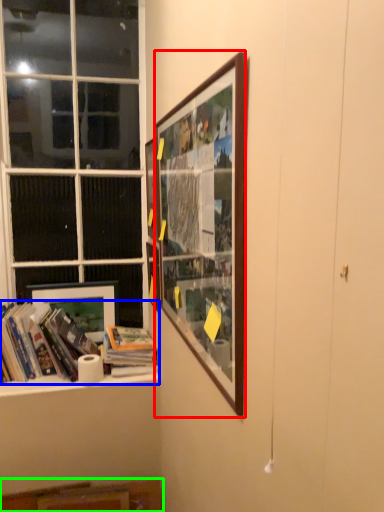
Question: Based on their relative distances, which object is farther from picture frame (highlighted by a red box)? Choose from book (highlighted by a blue box) and cabinet (highlighted by a green box).

Choices:
 (A) book
 (B) cabinet

Answer: (B)